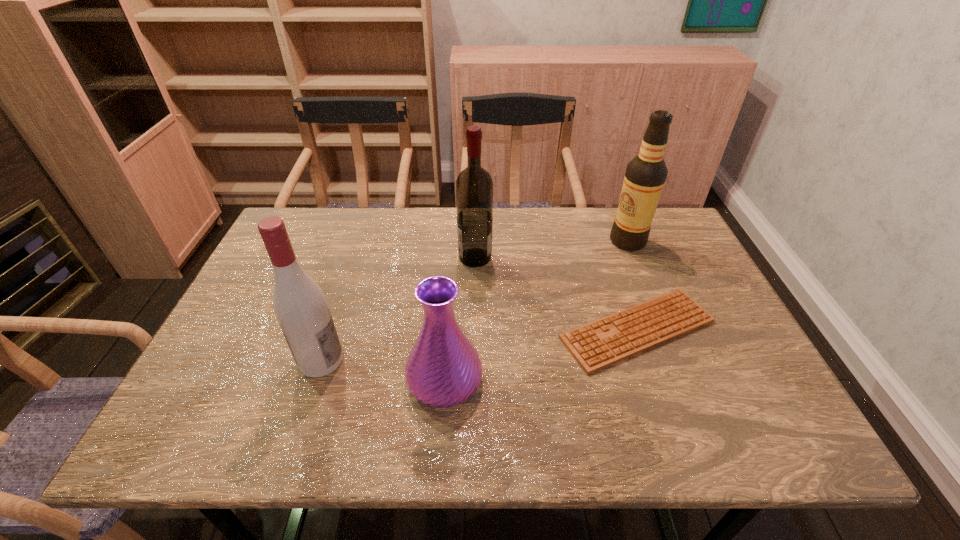
The image size is (960, 540). What are the coordinates of `free space at the near left corner` in the screenshot? It's located at (232, 441).

What are the coordinates of `vacant region at the far right corner of the desktop` in the screenshot? It's located at (657, 210).

Image resolution: width=960 pixels, height=540 pixels. Identify the location of vacant point at the near right corner. coord(787,434).

Find the location of a particular element. This screenshot has height=540, width=960. empty location between the rightmost alcohol and the fourth tallest object is located at coordinates (537, 310).

Where is `free area in between the second alcohol from left to right and the fourth tallest object`? The width and height of the screenshot is (960, 540). free area in between the second alcohol from left to right and the fourth tallest object is located at coordinates (460, 319).

Where is `free spot between the rightmost alcohol and the vase`? This screenshot has height=540, width=960. free spot between the rightmost alcohol and the vase is located at coordinates (537, 310).

You are a GUI agent. You are given a task and a screenshot of the screen. Output one action in this format:
    pyautogui.click(x=<x>, y=<y>)
    Task: Click on the free area in between the vase and the rightmost alcohol
    The image size is (960, 540).
    Given the screenshot: What is the action you would take?
    pyautogui.click(x=537, y=310)

The height and width of the screenshot is (540, 960). Find the location of `free spot between the leftmost alcohol and the computer keyboard`. free spot between the leftmost alcohol and the computer keyboard is located at coordinates (479, 345).

At what (x,y) coordinates should I click in order to perform the action: click on unoccupied area between the leftmost object and the second alcohol from left to right. Please return your answer as a coordinate pair (x, y). The width and height of the screenshot is (960, 540). Looking at the image, I should click on (398, 309).

Find the location of a particular element. This screenshot has height=540, width=960. free space between the fourth tallest object and the rightmost alcohol is located at coordinates (537, 310).